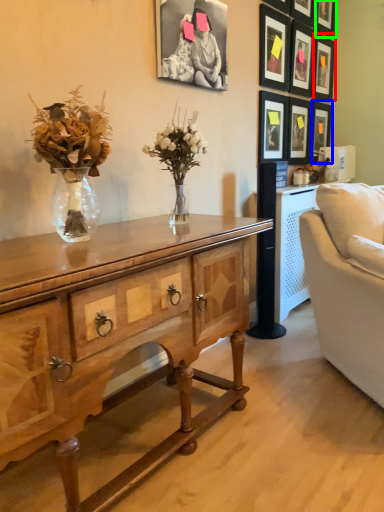
Question: Estimate the real-world distances between objects in this image. Which object is farther from picture frame (highlighted by a red box), picture frame (highlighted by a blue box) or picture frame (highlighted by a green box)?

Choices:
 (A) picture frame
 (B) picture frame

Answer: (A)